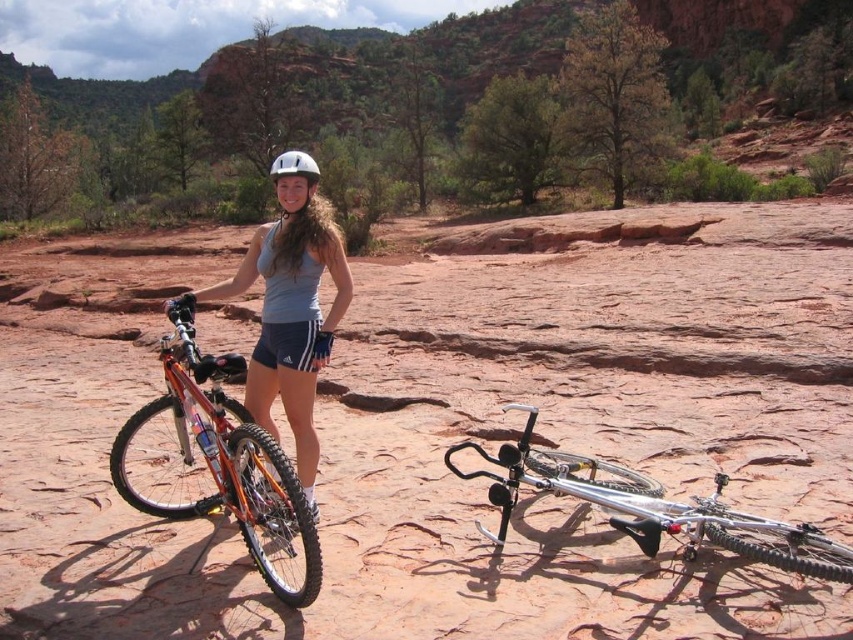
You are a photographer planning to take a photo of the dirt field at center and the white matte helmet at center. Which object should you focus on if you want to capture the larger subject in your shot?

The white matte helmet at center is larger than the dirt field at center, so you should focus on the white matte helmet at center to capture the larger subject.